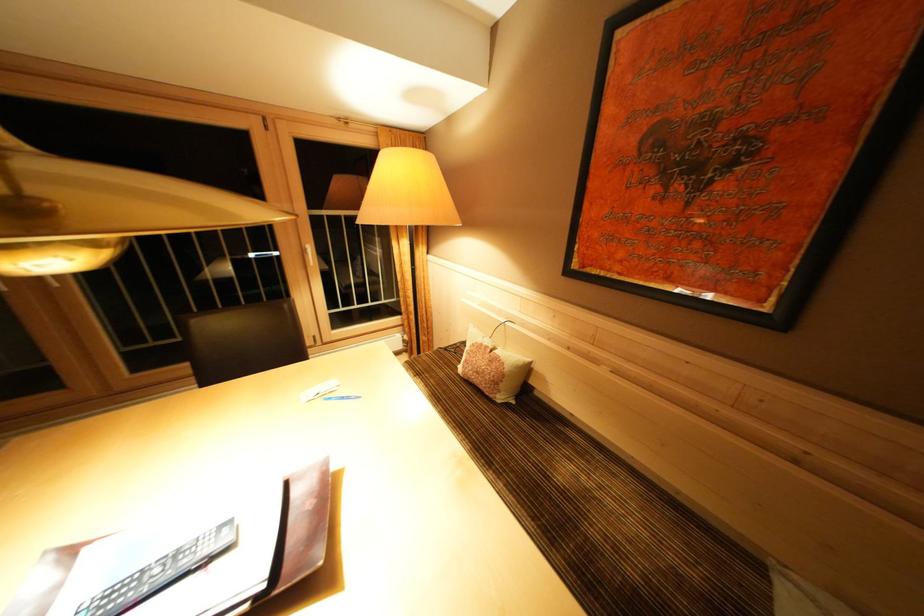
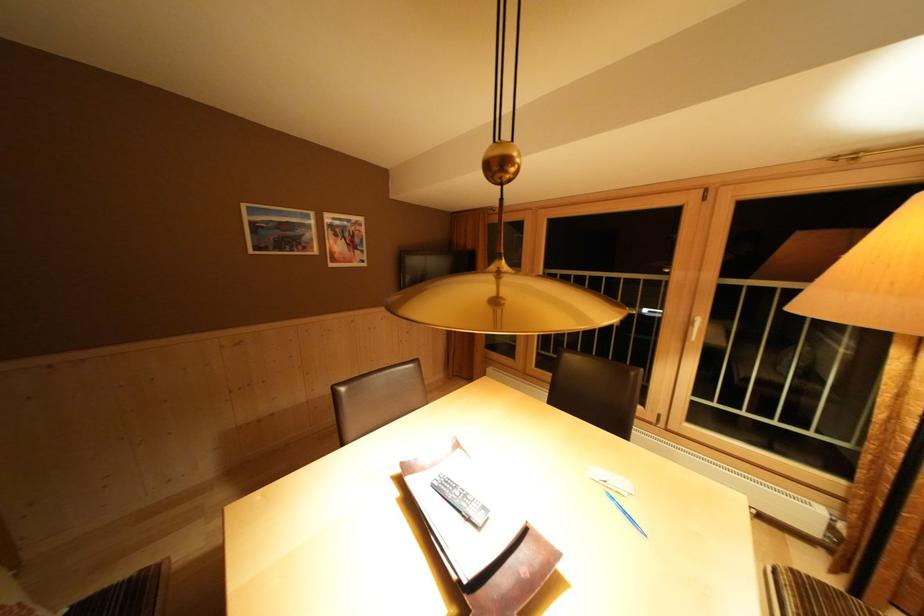
Find the pixel in the second image that matches (310,256) in the first image.

(697, 328)